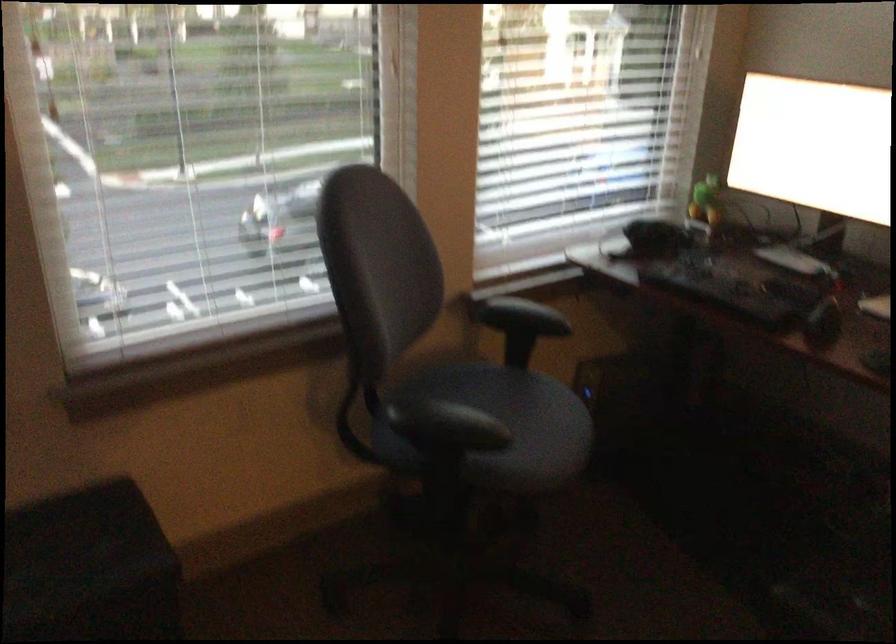
Where is `chair sitting surface`? The width and height of the screenshot is (896, 644). chair sitting surface is located at coordinates (533, 404).